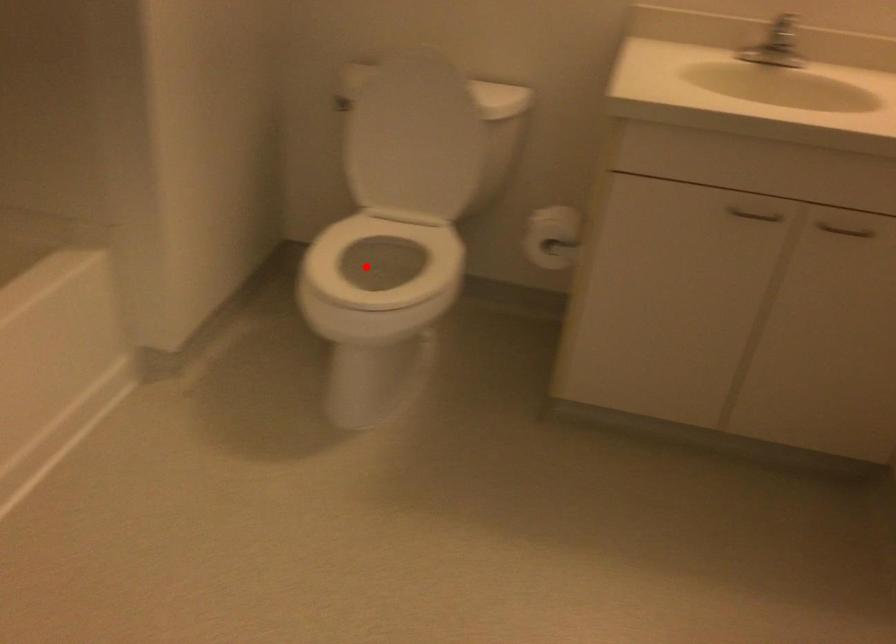
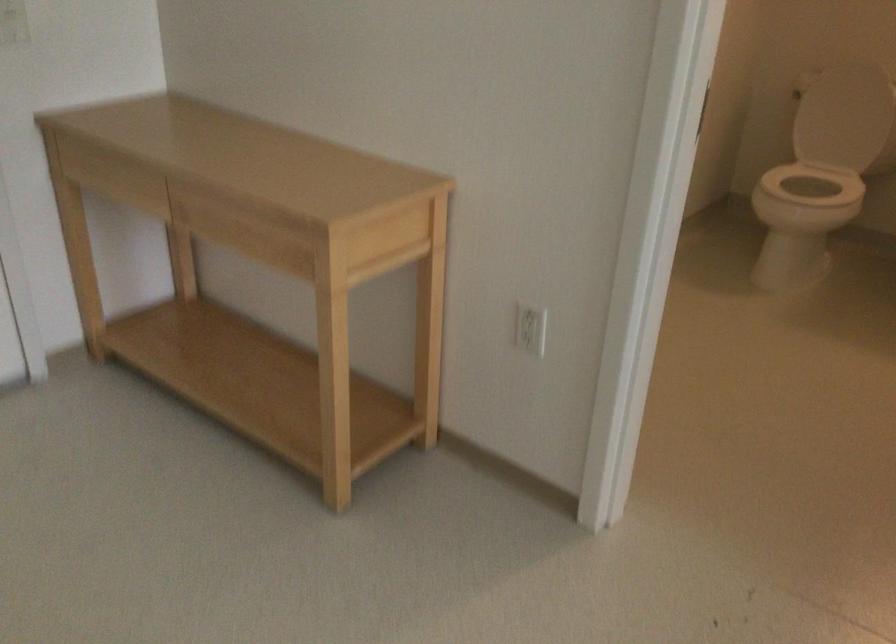
Question: I am providing you with two images of the same scene from different viewpoints. Given a red point in image1, look at the same physical point in image2. Is it:

Choices:
 (A) Closer to the viewpoint
 (B) Farther from the viewpoint

Answer: (B)